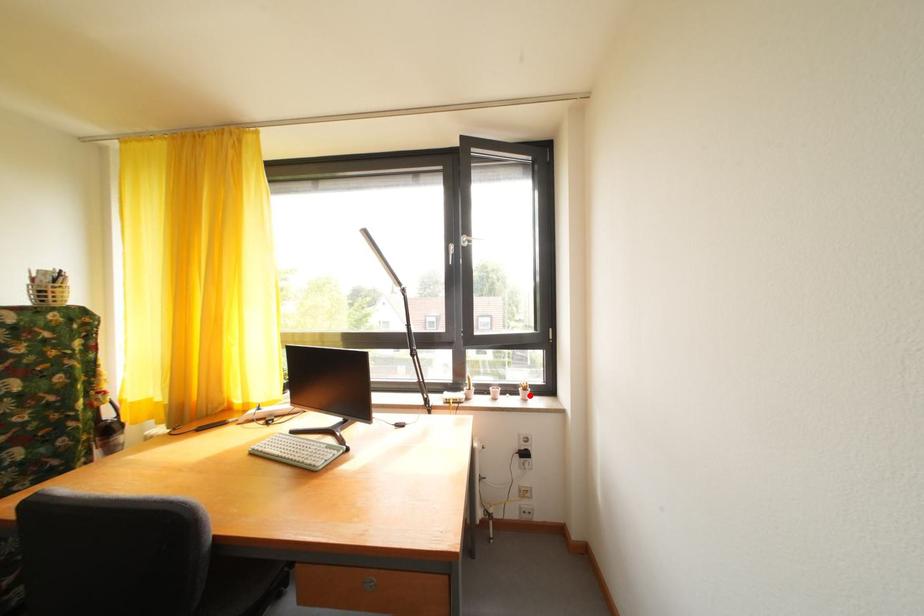
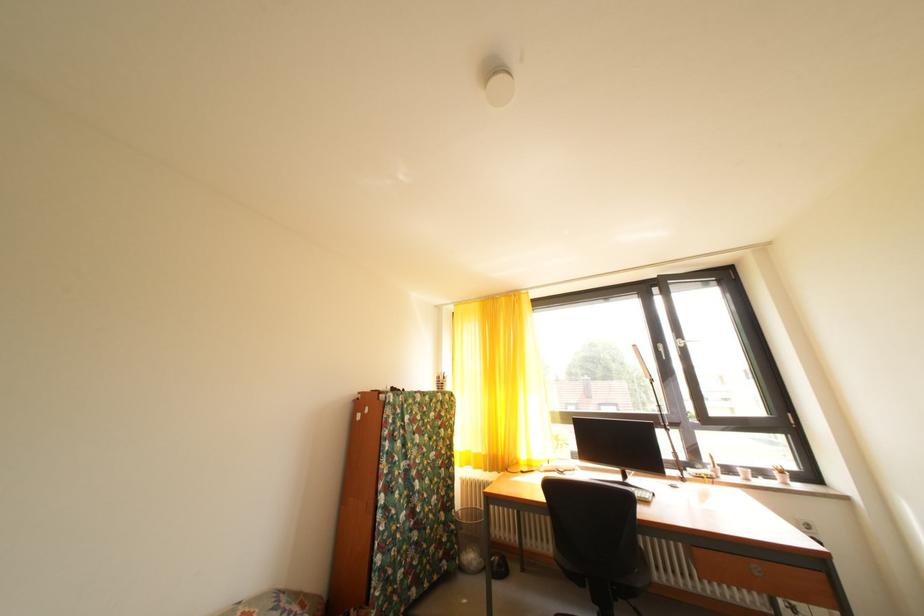
Question: I am providing you with two images of the same scene from different viewpoints. In image1, a red point is highlighted. Considering the same 3D point in image2, which of the following is correct?

Choices:
 (A) It is closer
 (B) It is farther

Answer: (A)